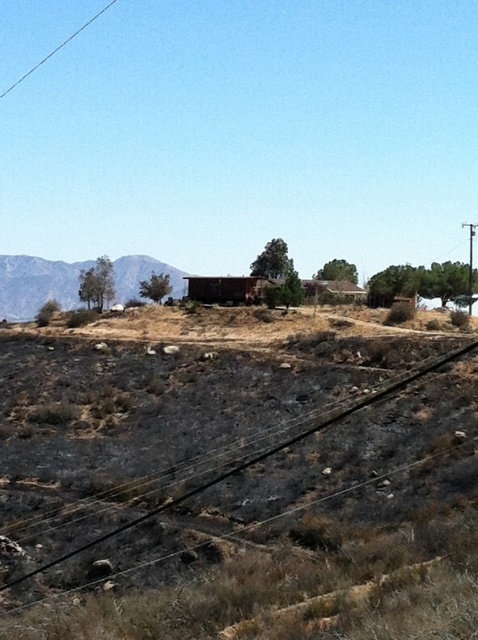
Is the position of black asphalt train track at lower center less distant than that of smooth wood telegraph pole at right?

Yes, it is in front of smooth wood telegraph pole at right.

Does black asphalt train track at lower center have a smaller size compared to smooth wood telegraph pole at right?

Yes, black asphalt train track at lower center is smaller than smooth wood telegraph pole at right.

Is point (442, 362) more distant than point (475, 228)?

No, it is not.

Locate an element on the screen. Image resolution: width=478 pixels, height=640 pixels. black asphalt train track at lower center is located at coordinates (250, 461).

Who is lower down, rugged brown mountain at left or smooth wood telegraph pole at right?

rugged brown mountain at left is lower down.

Does rugged brown mountain at left have a lesser width compared to smooth wood telegraph pole at right?

In fact, rugged brown mountain at left might be wider than smooth wood telegraph pole at right.

Is point (68, 308) in front of point (471, 228)?

Yes.

Find the location of a particular element. rugged brown mountain at left is located at coordinates (36, 284).

Does rugged brown mountain at left have a greater height compared to black asphalt train track at lower center?

Correct, rugged brown mountain at left is much taller as black asphalt train track at lower center.

I want to click on rugged brown mountain at left, so click(x=36, y=284).

Which is behind, point (55, 273) or point (156, 509)?

The point (55, 273) is more distant.

Find the location of `rugged brown mountain at left`. rugged brown mountain at left is located at coordinates (36, 284).